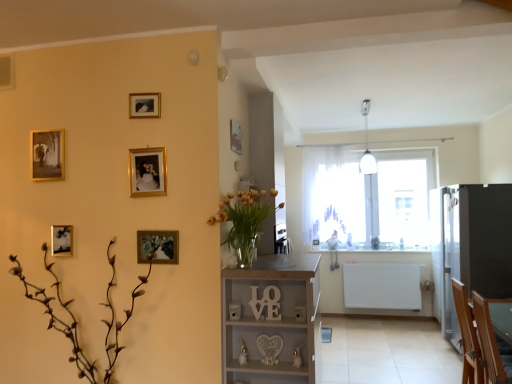
Question: Can you confirm if white sheer curtain at center is bigger than wooden armchair at lower right?

Choices:
 (A) no
 (B) yes

Answer: (B)

Question: Is white sheer curtain at center further to camera compared to wooden armchair at lower right?

Choices:
 (A) no
 (B) yes

Answer: (B)

Question: Is the surface of white sheer curtain at center in direct contact with wooden armchair at lower right?

Choices:
 (A) yes
 (B) no

Answer: (B)

Question: From the image's perspective, is white sheer curtain at center located above wooden armchair at lower right?

Choices:
 (A) no
 (B) yes

Answer: (B)

Question: Does white sheer curtain at center have a lesser width compared to wooden armchair at lower right?

Choices:
 (A) yes
 (B) no

Answer: (A)

Question: From a real-world perspective, is satin black fridge at right above or below wooden picture frame at center-left, which is the 6th picture frame from back to front?

Choices:
 (A) above
 (B) below

Answer: (B)

Question: Is satin black fridge at right taller or shorter than wooden picture frame at center-left, which is the 6th picture frame from back to front?

Choices:
 (A) short
 (B) tall

Answer: (B)

Question: Considering the positions of satin black fridge at right and wooden picture frame at center-left, which is the 6th picture frame from back to front, in the image, is satin black fridge at right wider or thinner than wooden picture frame at center-left, which is the 6th picture frame from back to front,?

Choices:
 (A) thin
 (B) wide

Answer: (B)

Question: Considering the positions of point (490, 243) and point (157, 249), is point (490, 243) closer or farther from the camera than point (157, 249)?

Choices:
 (A) farther
 (B) closer

Answer: (A)

Question: In terms of width, does gold metallic picture frame at upper center, the fifth picture frame from the back, look wider or thinner when compared to brown matte plant at lower left?

Choices:
 (A) wide
 (B) thin

Answer: (B)

Question: Is gold metallic picture frame at upper center, the second picture frame in the front-to-back sequence, taller or shorter than brown matte plant at lower left?

Choices:
 (A) short
 (B) tall

Answer: (A)

Question: Is gold metallic picture frame at upper center, the fifth picture frame from the back, situated inside brown matte plant at lower left or outside?

Choices:
 (A) inside
 (B) outside

Answer: (B)

Question: Is gold metallic picture frame at upper center, which is counted as the fourth picture frame, starting from the left, bigger or smaller than brown matte plant at lower left?

Choices:
 (A) small
 (B) big

Answer: (A)

Question: From a real-world perspective, relative to white sheer curtain at center, is translucent glass vase at center vertically above or below?

Choices:
 (A) below
 (B) above

Answer: (A)

Question: Is point (244, 216) closer or farther from the camera than point (317, 152)?

Choices:
 (A) farther
 (B) closer

Answer: (B)